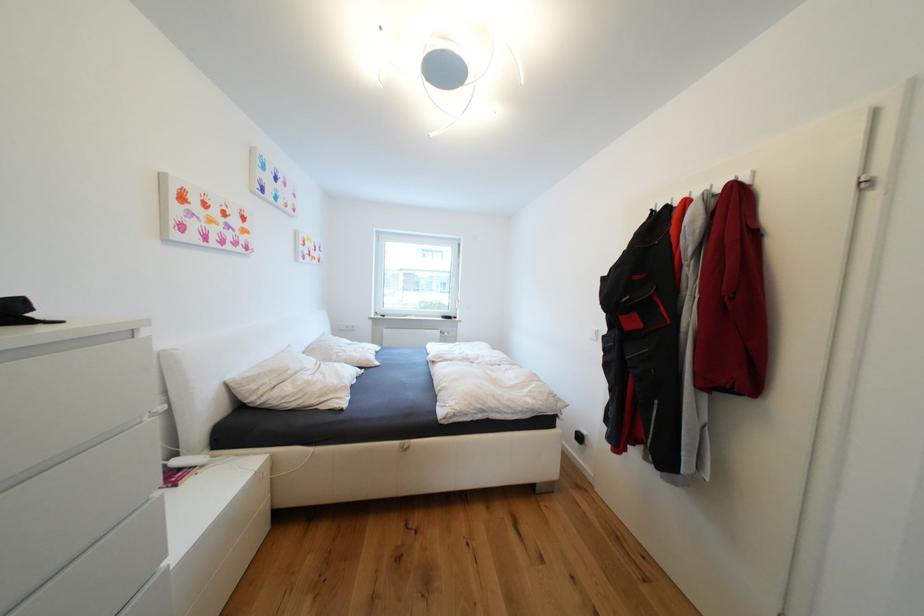
Where would you pull the window handle? Please return your answer as a coordinate pair (x, y).

(454, 298)